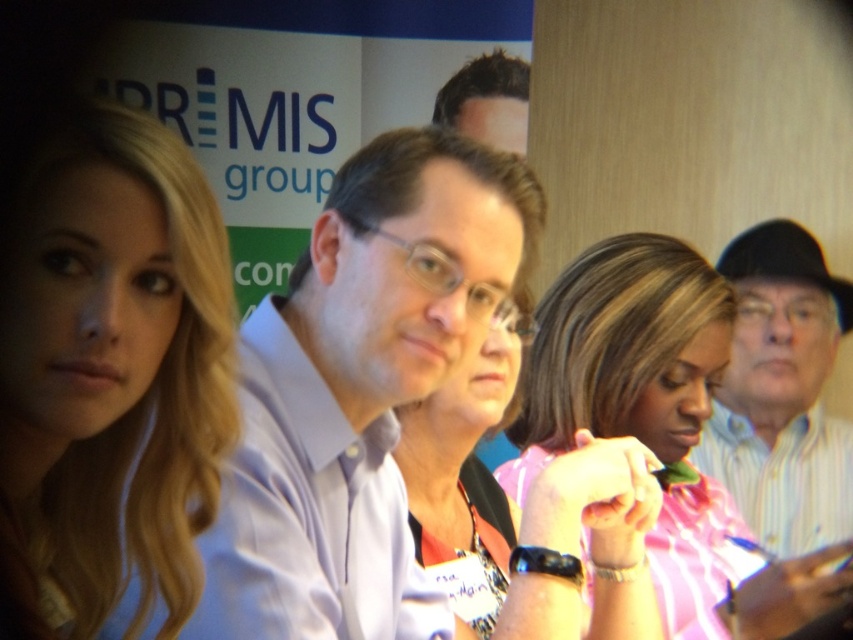
Which is in front, point (776, 385) or point (621, 456)?

Point (621, 456) is in front.

Does point (751, 291) come closer to viewer compared to point (454, 515)?

That is False.

The image size is (853, 640). I want to click on white striped shirt at right, so [782, 392].

Which is below, light blue shirt at center or dark brown hair at upper center?

light blue shirt at center

Between light blue shirt at center and dark brown hair at upper center, which one has more height?

light blue shirt at center is taller.

Where is `light blue shirt at center`? The image size is (853, 640). light blue shirt at center is located at coordinates (357, 384).

Is point (541, 410) more distant than point (521, 129)?

That is False.

Which is in front, point (648, 420) or point (485, 56)?

Positioned in front is point (648, 420).

Is point (666, 524) positioned after point (469, 115)?

No, it is in front of (469, 115).

This screenshot has height=640, width=853. Find the location of `pink striped shirt at center`. pink striped shirt at center is located at coordinates (659, 426).